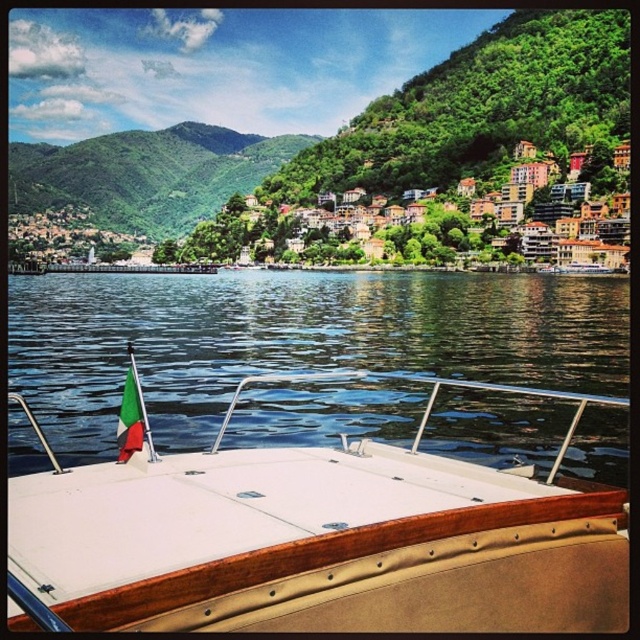
Question: Estimate the real-world distances between objects in this image. Which object is farther from the white wood boat at center?

Choices:
 (A) green leafy hillside at upper left
 (B) green fabric flag at center

Answer: (A)

Question: Which object appears closest to the camera in this image?

Choices:
 (A) clear water at boat front
 (B) white wood boat at center
 (C) green leafy hillside at upper left

Answer: (B)

Question: Can you confirm if white wood boat at center is thinner than green leafy hillside at upper left?

Choices:
 (A) no
 (B) yes

Answer: (B)

Question: Based on their relative distances, which object is farther from the green fabric flag at center?

Choices:
 (A) clear water at boat front
 (B) green leafy hillside at upper left
 (C) white wood boat at center

Answer: (B)

Question: Is the position of white wood boat at center less distant than that of clear water at boat front?

Choices:
 (A) yes
 (B) no

Answer: (A)

Question: Does green leafy hillside at upper left have a smaller size compared to green fabric flag at center?

Choices:
 (A) no
 (B) yes

Answer: (A)